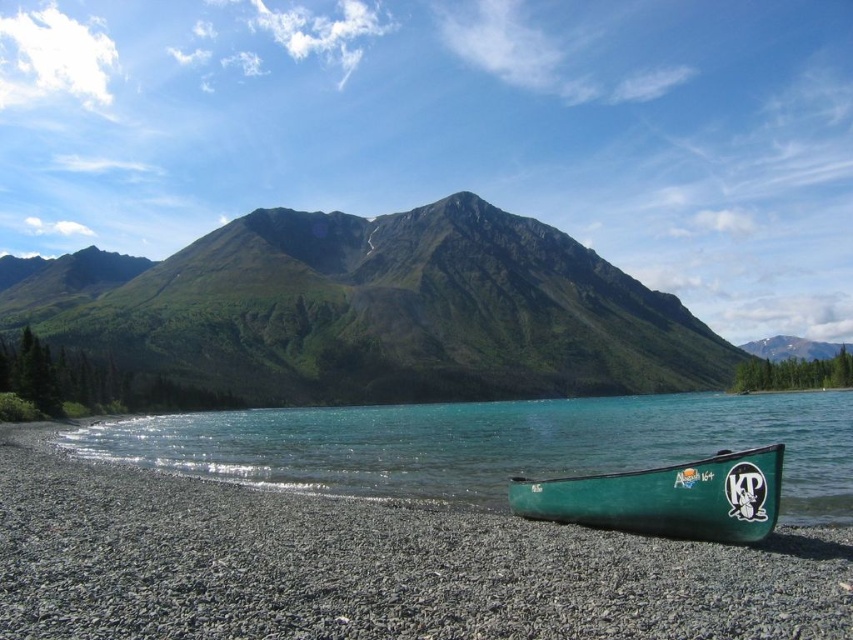
Can you confirm if green plastic canoe at lower right is smaller than green matte canoe at lower right?

Incorrect, green plastic canoe at lower right is not smaller in size than green matte canoe at lower right.

Who is higher up, green plastic canoe at lower right or green matte canoe at lower right?

green matte canoe at lower right

Between point (196, 413) and point (590, 508), which one is positioned behind?

Point (196, 413)

At what (x,y) coordinates should I click in order to perform the action: click on green plastic canoe at lower right. Please return your answer as a coordinate pair (x, y). Looking at the image, I should click on (494, 444).

Which is more to the right, green grassy mountain at center or green matte canoe at lower right?

Positioned to the right is green matte canoe at lower right.

Which is more to the left, green grassy mountain at center or green matte canoe at lower right?

Positioned to the left is green grassy mountain at center.

Does point (212, 276) come in front of point (724, 524)?

No.

At what (x,y) coordinates should I click in order to perform the action: click on green grassy mountain at center. Please return your answer as a coordinate pair (x, y). Looking at the image, I should click on (374, 310).

Does green plastic canoe at lower center appear on the right side of green grassy mountain at center?

Correct, you'll find green plastic canoe at lower center to the right of green grassy mountain at center.

Can you confirm if green plastic canoe at lower center is bigger than green grassy mountain at center?

Incorrect, green plastic canoe at lower center is not larger than green grassy mountain at center.

From the picture: Who is more forward, (13, 461) or (120, 310)?

Point (13, 461)

You are a GUI agent. You are given a task and a screenshot of the screen. Output one action in this format:
    pyautogui.click(x=<x>, y=<y>)
    Task: Click on the green plastic canoe at lower center
    
    Given the screenshot: What is the action you would take?
    pos(369,564)